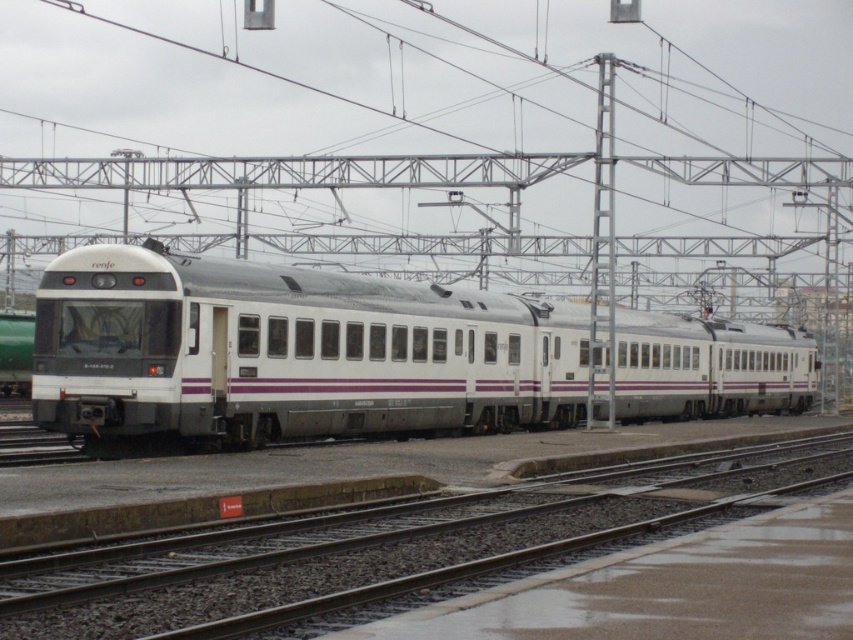
You are standing at the railway station and see the white glossy train at center and the metal track at center. Which object is closer to you?

The white glossy train at center is closer to you than the metal track at center.

Looking at this image, you are a railway engineer assessing the safety of the white glossy train at center on the metal track at center. Based on the provided scene, can the train safely pass through the track without any adjustments?

The white glossy train at center is wider than the metal track at center, so the train cannot safely pass through the track without adjustments. The track is narrower than the train, which would cause a collision risk.

You are standing at the station platform and want to know which of the two points, point (396, 301) or point (331, 595), is closer to you. Based on the train layout, which point is nearer?

Point (396, 301) is closer to you because it is further to the viewer than point (331, 595).